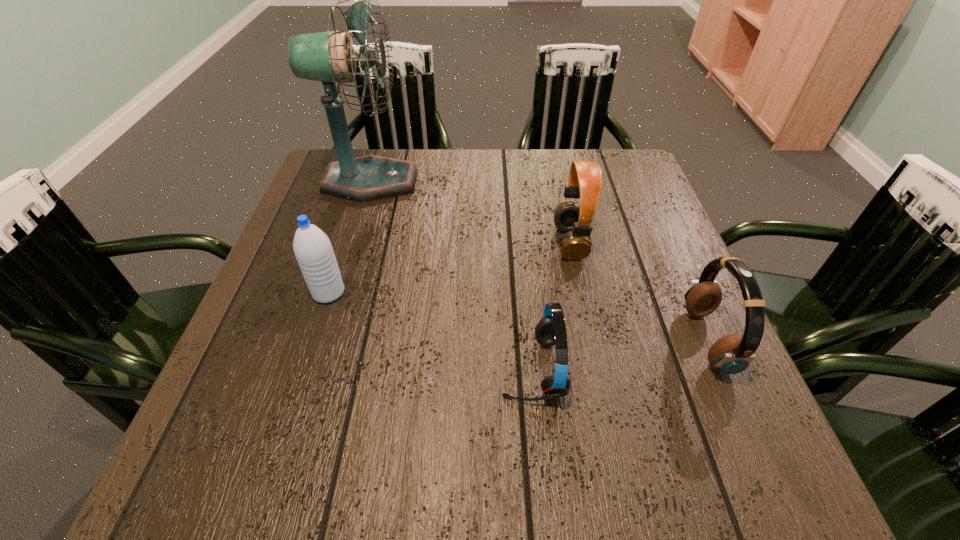
Locate an element on the screen. the farthest object is located at coordinates (329, 57).

This screenshot has width=960, height=540. In order to click on fan in this screenshot , I will do `click(329, 57)`.

The width and height of the screenshot is (960, 540). In order to click on the second farthest object in this screenshot , I will do `click(585, 179)`.

Locate an element on the screen. the farthest headset is located at coordinates [x=585, y=179].

Where is `water bottle`? The image size is (960, 540). water bottle is located at coordinates (312, 248).

This screenshot has height=540, width=960. Find the location of `the rightmost headset`. the rightmost headset is located at coordinates (731, 354).

The height and width of the screenshot is (540, 960). Identify the location of the leftmost headset. (551, 330).

The width and height of the screenshot is (960, 540). What are the coordinates of `the shortest object` in the screenshot? It's located at (551, 330).

The height and width of the screenshot is (540, 960). Find the location of `free space located in front of the fan where the wind blows`. free space located in front of the fan where the wind blows is located at coordinates (483, 181).

Locate an element on the screen. The height and width of the screenshot is (540, 960). free space located on the ear cups of the fourth object from left to right is located at coordinates (498, 242).